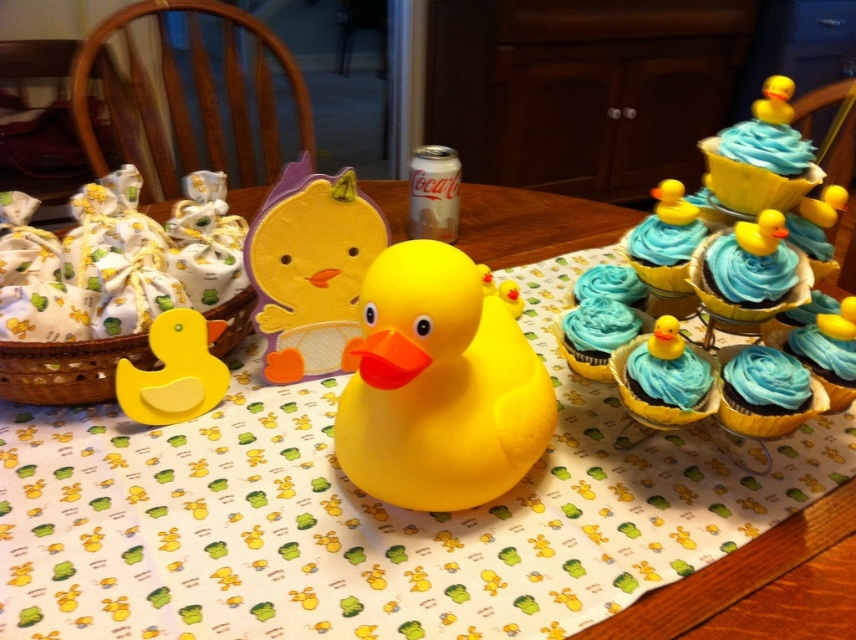
You are a photographer holding a camera and want to take a closeup shot of the blue frosting cupcake at center right. The camera requires the subject to be at least 12 inches away to focus properly. Can you take the photo without moving the cupcake or the camera?

The blue frosting cupcake at center right is 13.09 inches away from the camera, which is more than the minimum 12 inches required for proper focus. Therefore, you can take the photo without moving either the cupcake or the camera.

You are a guest at the baby shower and want to place a small gift on the table. The small gift is exactly the same size as the matte yellow rubber duck at lower left. Is there enough space between the yellow rubber duck at center and the edge of the table to place your gift without overlapping any existing items?

The yellow rubber duck at center is larger in size than the matte yellow rubber duck at lower left. Since your gift is the same size as the smaller matte yellow rubber duck at lower left, there should be sufficient space between the larger yellow rubber duck at center and the table edge to place it without overlapping.

You are a guest at the baby shower and want to grab a cupcake before the speeches start. The blue glossy cupcake at upper right is your favorite. However, you need to reach it without moving the yellow rubber duck at center. Can you do it?

The yellow rubber duck at center is located below the blue glossy cupcake at upper right, so the cupcake is above the duck. Since the duck is in the center and the cupcake is at the upper right, you can reach the blue glossy cupcake at upper right without moving the yellow rubber duck at center by approaching from the side opposite to the duck.